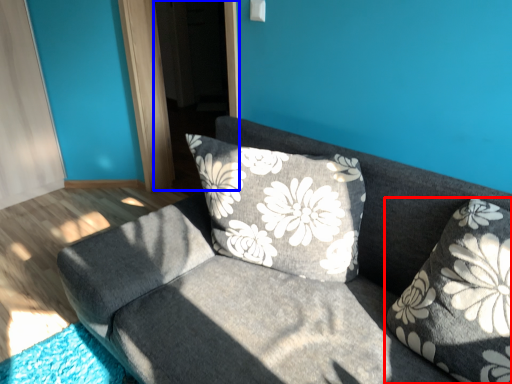
Question: Among these objects, which one is nearest to the camera, pillow (highlighted by a red box) or screen door (highlighted by a blue box)?

Choices:
 (A) pillow
 (B) screen door

Answer: (A)